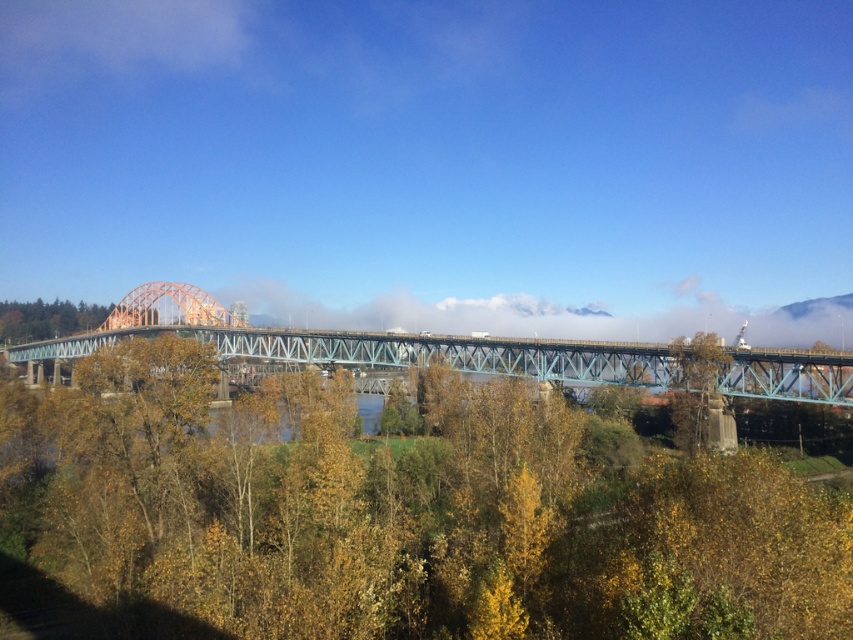
Question: Is yellow leafy tree at center thinner than teal metallic bridge at center?

Choices:
 (A) no
 (B) yes

Answer: (B)

Question: Which point appears farthest from the camera in this image?

Choices:
 (A) (817, 385)
 (B) (798, 620)

Answer: (A)

Question: Which of the following is the farthest from the observer?

Choices:
 (A) (660, 563)
 (B) (779, 360)

Answer: (B)

Question: Which point is closer to the camera?

Choices:
 (A) teal metallic bridge at center
 (B) yellow leafy tree at center

Answer: (B)

Question: Does yellow leafy tree at center have a smaller size compared to teal metallic bridge at center?

Choices:
 (A) yes
 (B) no

Answer: (A)

Question: Is yellow leafy tree at center below teal metallic bridge at center?

Choices:
 (A) yes
 (B) no

Answer: (A)